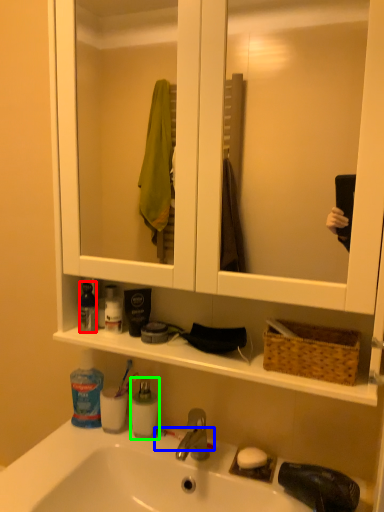
Question: Estimate the real-world distances between objects in this image. Which object is closer to cleaning product (highlighted by a red box), toothbrush (highlighted by a blue box) or mouthwash (highlighted by a green box)?

Choices:
 (A) toothbrush
 (B) mouthwash

Answer: (B)